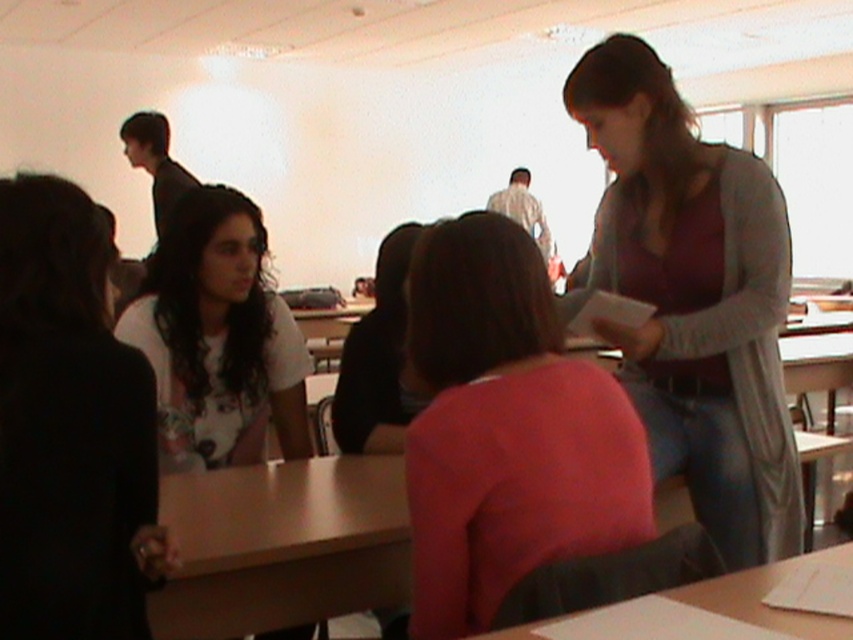
Question: Considering the real-world distances, which object is closest to the gray sweater at right?

Choices:
 (A) smooth wooden table at lower center
 (B) pink matte shirt at center

Answer: (B)

Question: Can you confirm if gray sweater at right is positioned to the left of dark brown hair at upper left?

Choices:
 (A) yes
 (B) no

Answer: (B)

Question: From the image, what is the correct spatial relationship of gray sweater at right in relation to pink matte shirt at center?

Choices:
 (A) above
 (B) below

Answer: (A)

Question: Which point appears closest to the camera in this image?

Choices:
 (A) (247, 262)
 (B) (761, 323)

Answer: (B)

Question: Is the position of gray sweater at right more distant than that of dark brown hair at upper left?

Choices:
 (A) no
 (B) yes

Answer: (A)

Question: Among these objects, which one is farthest from the camera?

Choices:
 (A) dark brown hair at upper left
 (B) white matte shirt at left

Answer: (A)